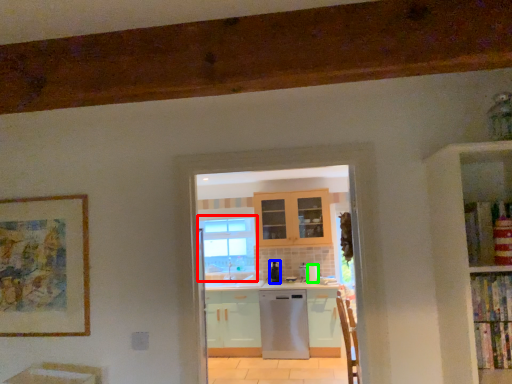
Question: Which object is positioned closest to window (highlighted by a red box)? Select from kitchen appliance (highlighted by a blue box) and appliance (highlighted by a green box).

Choices:
 (A) kitchen appliance
 (B) appliance

Answer: (A)